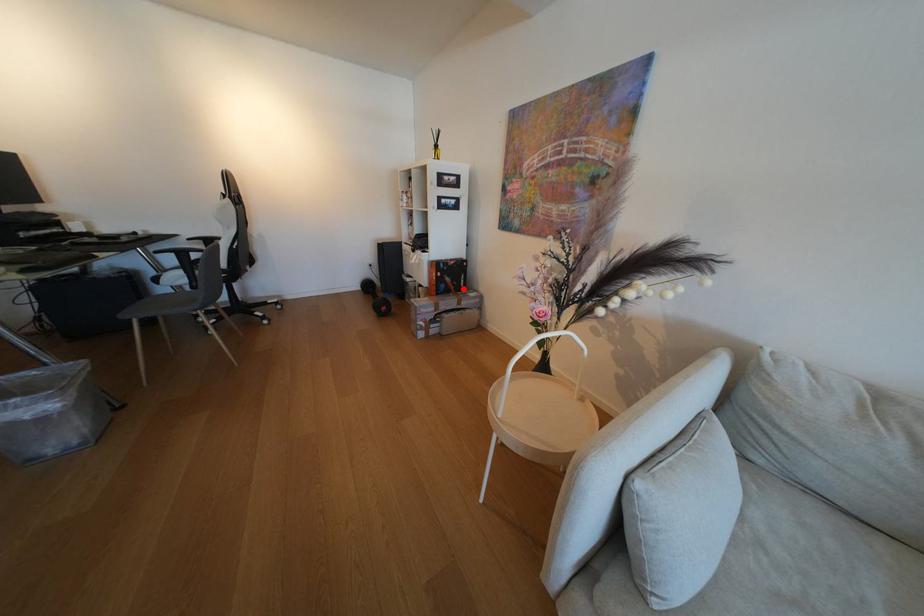
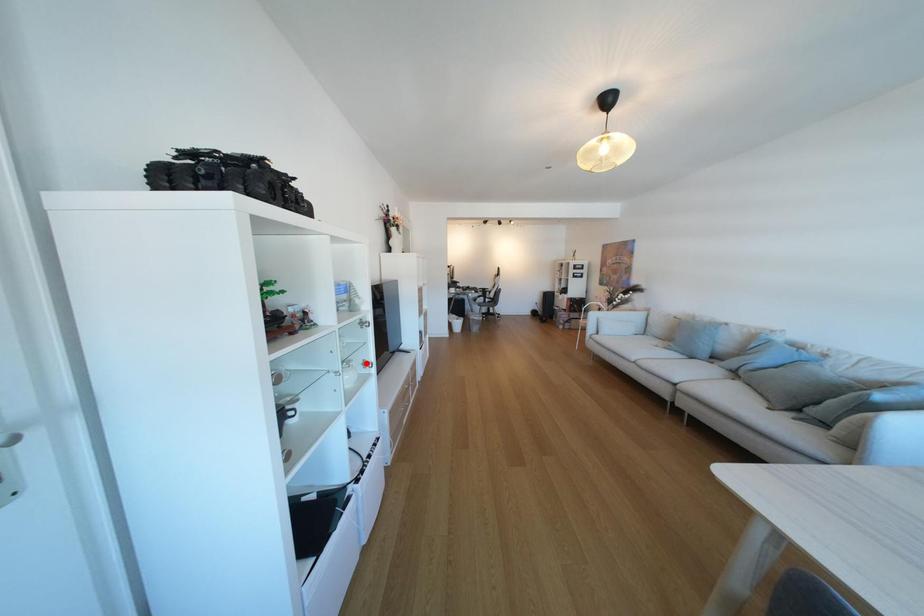
I am providing you with two images of the same scene from different viewpoints. A red point is marked on the first image and another point is marked on the second image. Are the points marked in image1 and image2 representing the same 3D position?

No